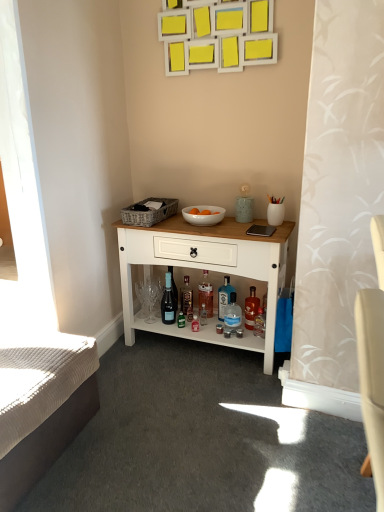
Question: Is white glossy bowl at center thinner than white textured mattress at lower left?

Choices:
 (A) yes
 (B) no

Answer: (A)

Question: Is white glossy bowl at center taller than white textured mattress at lower left?

Choices:
 (A) no
 (B) yes

Answer: (A)

Question: From a real-world perspective, is white glossy bowl at center positioned over white textured mattress at lower left based on gravity?

Choices:
 (A) yes
 (B) no

Answer: (A)

Question: Is white glossy bowl at center aimed at white textured mattress at lower left?

Choices:
 (A) yes
 (B) no

Answer: (B)

Question: Does white glossy bowl at center come behind white textured mattress at lower left?

Choices:
 (A) yes
 (B) no

Answer: (A)

Question: Looking at their shapes, would you say matte glass wine bottle at center is wider or thinner than translucent glass bottle at lower center, placed as the fifth bottle when sorted from left to right?

Choices:
 (A) wide
 (B) thin

Answer: (B)

Question: Which is correct: matte glass wine bottle at center is inside translucent glass bottle at lower center, placed as the fifth bottle when sorted from left to right, or outside of it?

Choices:
 (A) outside
 (B) inside

Answer: (A)

Question: Considering their positions, is matte glass wine bottle at center located in front of or behind translucent glass bottle at lower center, placed as the fifth bottle when sorted from left to right?

Choices:
 (A) front
 (B) behind

Answer: (B)

Question: From the image's perspective, is matte glass wine bottle at center above or below translucent glass bottle at lower center, which appears as the first bottle when viewed from the right?

Choices:
 (A) above
 (B) below

Answer: (A)

Question: Is translucent glass bottle at lower center, placed as the fifth bottle when sorted from left to right, spatially inside transparent glass bottle at center, which is counted as the second bottle, starting from the right, or outside of it?

Choices:
 (A) inside
 (B) outside

Answer: (B)

Question: In terms of width, does translucent glass bottle at lower center, which appears as the first bottle when viewed from the right, look wider or thinner when compared to transparent glass bottle at center, the 4th bottle when ordered from left to right?

Choices:
 (A) thin
 (B) wide

Answer: (B)

Question: In terms of size, does translucent glass bottle at lower center, placed as the fifth bottle when sorted from left to right, appear bigger or smaller than transparent glass bottle at center, the 4th bottle when ordered from left to right?

Choices:
 (A) big
 (B) small

Answer: (A)

Question: Would you say translucent glass bottle at lower center, placed as the fifth bottle when sorted from left to right, is to the left or to the right of transparent glass bottle at center, which is counted as the second bottle, starting from the right, in the picture?

Choices:
 (A) right
 (B) left

Answer: (A)

Question: Considering the positions of point (218, 292) and point (253, 314), is point (218, 292) closer or farther from the camera than point (253, 314)?

Choices:
 (A) farther
 (B) closer

Answer: (A)

Question: From a real-world perspective, is blue glass bottle at lower center, which ranks as the 3th bottle in right-to-left order, above or below translucent glass bottle at lower center, placed as the fifth bottle when sorted from left to right?

Choices:
 (A) below
 (B) above

Answer: (B)